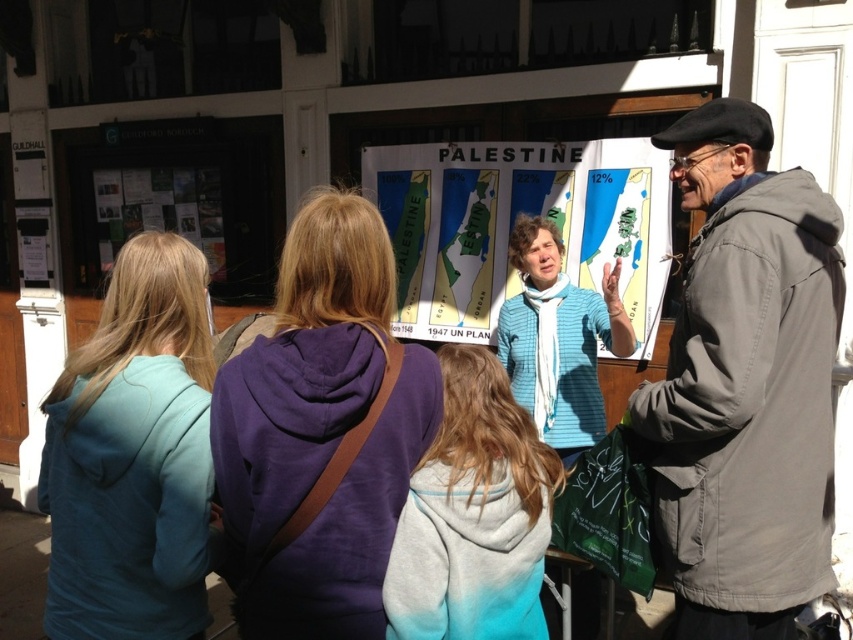
Does gray cotton jacket at right have a larger size compared to teal hoodie at left?

Yes.

Where is `gray cotton jacket at right`? gray cotton jacket at right is located at coordinates (746, 385).

Does gray cotton jacket at right appear over knitted blue sweater at center?

Incorrect, gray cotton jacket at right is not positioned above knitted blue sweater at center.

From the picture: Who is shorter, gray cotton jacket at right or knitted blue sweater at center?

Standing shorter between the two is knitted blue sweater at center.

Which is in front, point (767, 138) or point (526, 308)?

Positioned in front is point (767, 138).

This screenshot has height=640, width=853. In order to click on gray cotton jacket at right in this screenshot , I will do `click(746, 385)`.

Which is below, light blue hoodie at center or knitted blue sweater at center?

Positioned lower is light blue hoodie at center.

Measure the distance from light blue hoodie at center to knitted blue sweater at center.

A distance of 4.73 feet exists between light blue hoodie at center and knitted blue sweater at center.

Locate an element on the screen. This screenshot has width=853, height=640. light blue hoodie at center is located at coordinates pyautogui.click(x=473, y=515).

At what (x,y) coordinates should I click in order to perform the action: click on light blue hoodie at center. Please return your answer as a coordinate pair (x, y). This screenshot has height=640, width=853. Looking at the image, I should click on (473, 515).